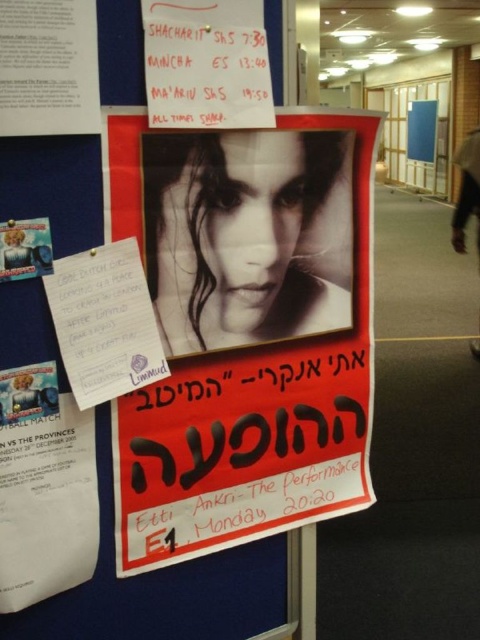
Can you confirm if smooth skin portrait at center is thinner than black hair at upper center?

Incorrect, smooth skin portrait at center's width is not less than black hair at upper center's.

Can you confirm if smooth skin portrait at center is positioned below black hair at upper center?

Yes.

This screenshot has width=480, height=640. What do you see at coordinates (243, 241) in the screenshot? I see `smooth skin portrait at center` at bounding box center [243, 241].

Where is `smooth skin portrait at center`? The width and height of the screenshot is (480, 640). smooth skin portrait at center is located at coordinates (243, 241).

Between matte paper poster at center and black hair at upper center, which one has less height?

With less height is black hair at upper center.

Is matte paper poster at center behind black hair at upper center?

No, matte paper poster at center is in front of black hair at upper center.

Is point (266, 394) positioned behind point (456, 214)?

That is False.

This screenshot has height=640, width=480. I want to click on matte paper poster at center, so click(x=245, y=330).

Who is higher up, matte paper poster at upper left or black hair at upper center?

Positioned higher is black hair at upper center.

Does point (3, 51) come behind point (479, 257)?

No, (3, 51) is in front of (479, 257).

Identify the location of matte paper poster at upper left. (48, 67).